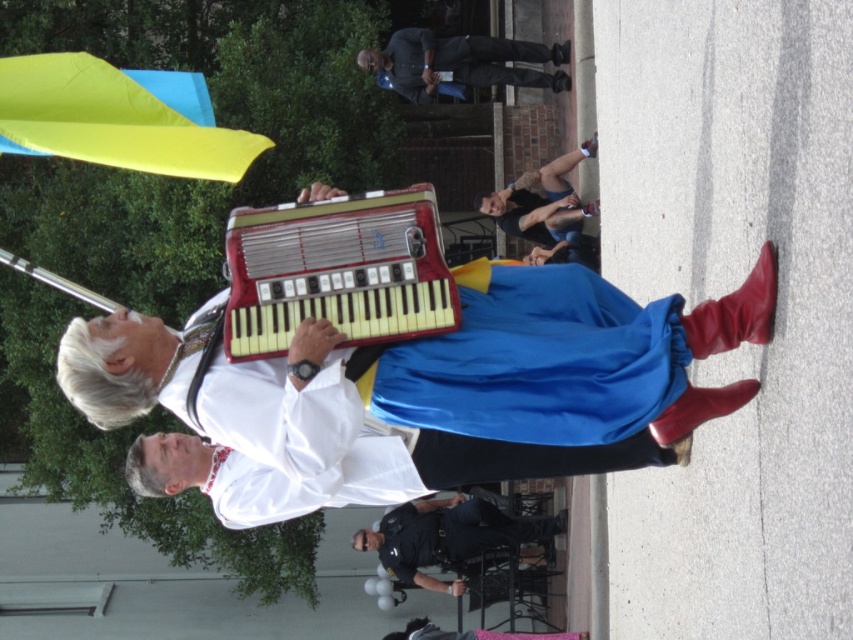
You are standing in the street scene and want to locate the point at coordinates (337, 269). According to the scene description, where exactly is this point located?

The point at coordinates (337, 269) is located on the metallic red accordion at center.

You are a photographer standing in front of the metallic red accordion at center and the dark blue uniform at center. You want to capture both in your shot. Which object should you focus on first to ensure both are in clear view?

You should focus on the metallic red accordion at center first since it is closer to the viewer than the dark blue uniform at center, ensuring both will be in focus when focusing on the closer object.

You are a street performer who needs to retrieve your metallic red accordion at center after your performance. You are currently standing 5 meters away from where you were performing. Can you reach it without moving more than 3 meters?

The metallic red accordion at center is 8.16 meters away from the viewer. Since you are currently 5 meters away from your performance spot, you would need to move 3.16 meters to reach it, which exceeds the 3 meters limit. Therefore, you cannot reach it without moving more than 3 meters.